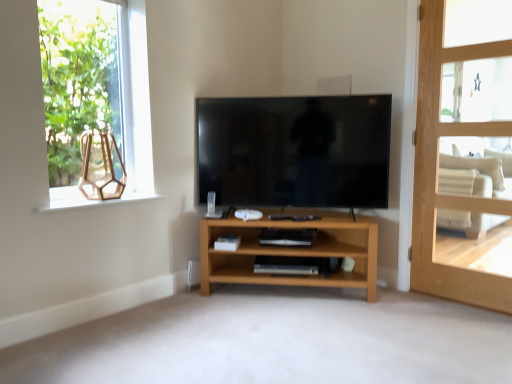
Question: Considering the relative sizes of light brown wooden door at right and light wood shelf at center in the image provided, is light brown wooden door at right smaller than light wood shelf at center?

Choices:
 (A) yes
 (B) no

Answer: (A)

Question: Is light brown wooden door at right far away from light wood shelf at center?

Choices:
 (A) no
 (B) yes

Answer: (B)

Question: Does light brown wooden door at right have a lesser width compared to light wood shelf at center?

Choices:
 (A) no
 (B) yes

Answer: (B)

Question: From the image's perspective, is light brown wooden door at right above light wood shelf at center?

Choices:
 (A) no
 (B) yes

Answer: (B)

Question: Does light brown wooden door at right have a greater height compared to light wood shelf at center?

Choices:
 (A) no
 (B) yes

Answer: (B)

Question: From a real-world perspective, is light brown wooden door at right over light wood shelf at center?

Choices:
 (A) no
 (B) yes

Answer: (B)

Question: Is beige fabric armchair at right to the left of light wood shelf at center from the viewer's perspective?

Choices:
 (A) no
 (B) yes

Answer: (A)

Question: Does beige fabric armchair at right have a lesser height compared to light wood shelf at center?

Choices:
 (A) no
 (B) yes

Answer: (A)

Question: Can you confirm if beige fabric armchair at right is wider than light wood shelf at center?

Choices:
 (A) no
 (B) yes

Answer: (B)

Question: Does beige fabric armchair at right have a greater height compared to light wood shelf at center?

Choices:
 (A) no
 (B) yes

Answer: (B)

Question: Is beige fabric armchair at right thinner than light wood shelf at center?

Choices:
 (A) no
 (B) yes

Answer: (A)

Question: Can you confirm if beige fabric armchair at right is bigger than light wood shelf at center?

Choices:
 (A) no
 (B) yes

Answer: (B)

Question: Is black glossy tv at center behind matte glass window sill at upper left?

Choices:
 (A) yes
 (B) no

Answer: (A)